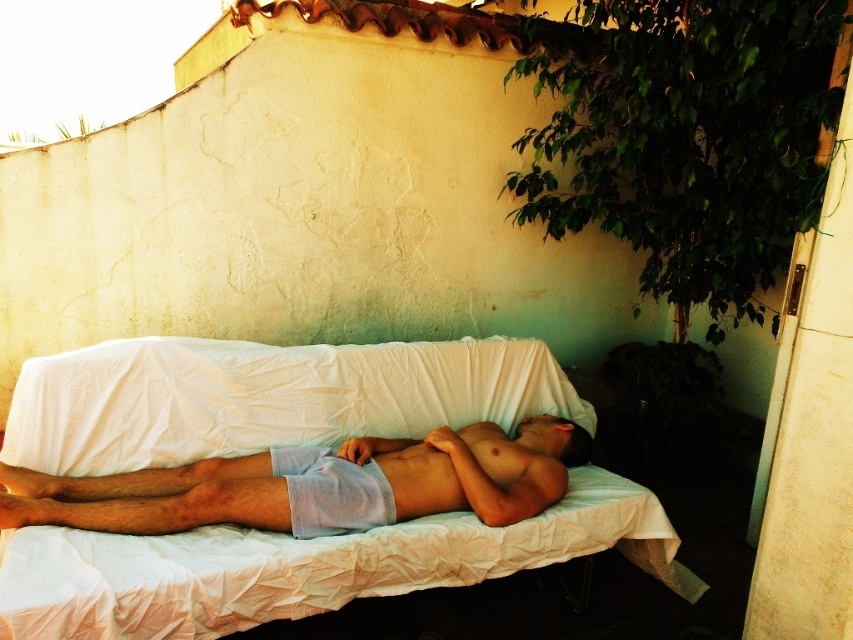
Question: Is white fabric bed at center below light blue cotton shorts at center?

Choices:
 (A) no
 (B) yes

Answer: (A)

Question: Which point is farther to the camera?

Choices:
 (A) (x=251, y=460)
 (B) (x=318, y=547)

Answer: (A)

Question: Is white fabric bed at center to the right of light blue cotton shorts at center from the viewer's perspective?

Choices:
 (A) no
 (B) yes

Answer: (A)

Question: Is white fabric bed at center bigger than light blue cotton shorts at center?

Choices:
 (A) no
 (B) yes

Answer: (B)

Question: Among these objects, which one is farthest from the camera?

Choices:
 (A) white fabric bed at center
 (B) light blue cotton shorts at center

Answer: (A)

Question: Which point appears farthest from the camera in this image?

Choices:
 (A) (163, 518)
 (B) (105, 376)

Answer: (B)